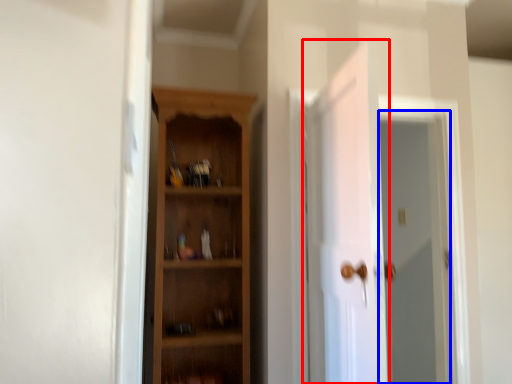
Question: Which object appears closest to the camera in this image, door (highlighted by a red box) or screen door (highlighted by a blue box)?

Choices:
 (A) door
 (B) screen door

Answer: (A)